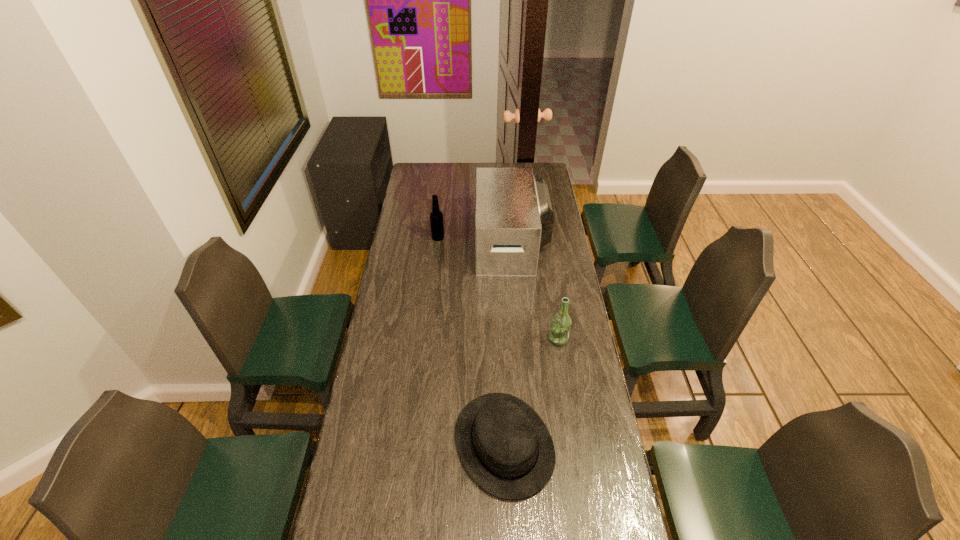
I want to click on microwave oven, so click(514, 218).

The width and height of the screenshot is (960, 540). I want to click on the farther beer bottle, so click(x=436, y=216).

Locate an element on the screen. The image size is (960, 540). the leftmost object is located at coordinates (436, 216).

Where is `the right beer bottle`? the right beer bottle is located at coordinates (560, 327).

Locate an element on the screen. Image resolution: width=960 pixels, height=540 pixels. the nearer beer bottle is located at coordinates (560, 327).

This screenshot has width=960, height=540. Find the location of `fedora`. fedora is located at coordinates (504, 445).

Where is `the nearest object`? The height and width of the screenshot is (540, 960). the nearest object is located at coordinates (504, 445).

Locate an element on the screen. Image resolution: width=960 pixels, height=540 pixels. free space located 0.380m on the front-facing side of the microwave oven is located at coordinates (397, 242).

Image resolution: width=960 pixels, height=540 pixels. Identify the location of free space located on the front-facing side of the microwave oven. (416, 242).

Identify the location of free space located on the front-facing side of the microwave oven. (406, 242).